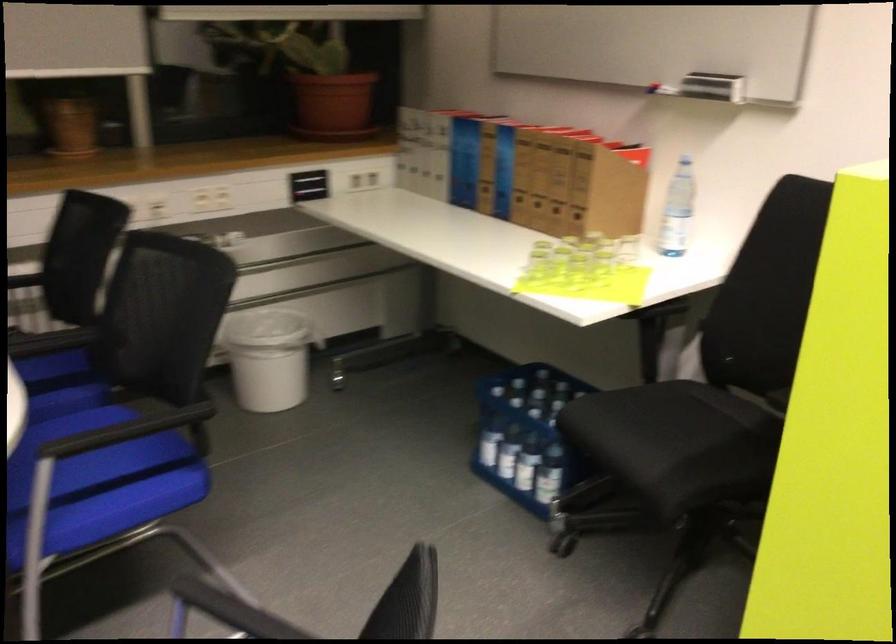
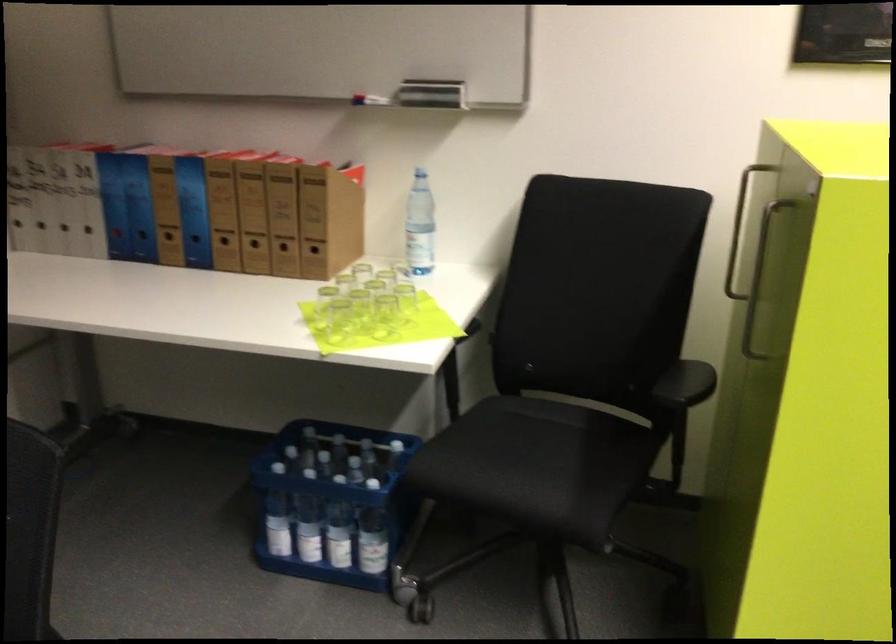
The point at (686, 212) is marked in the first image. Where is the corresponding point in the second image?

(419, 225)